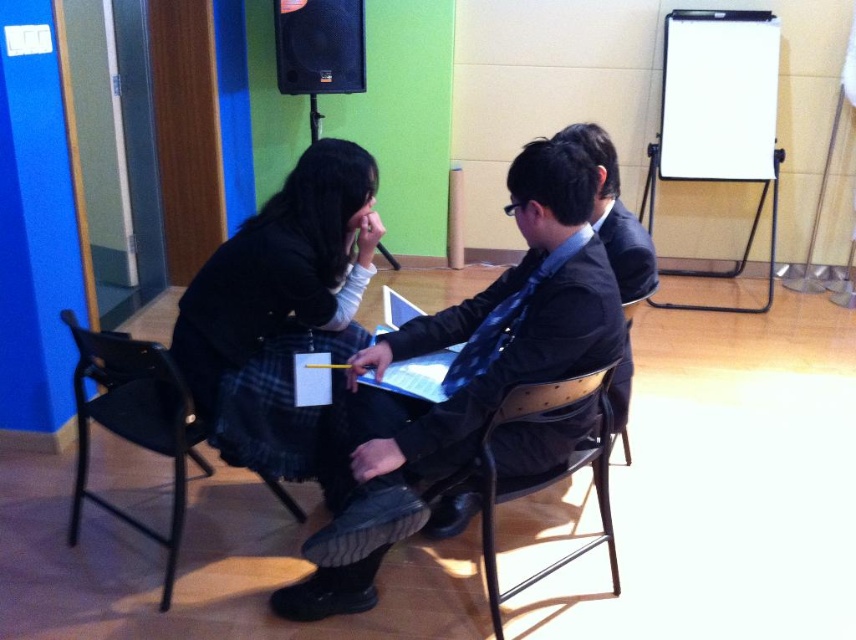
Question: Which object is positioned closest to the blue checkered tie at center?

Choices:
 (A) brown leather chair at center
 (B) metallic black chair at center

Answer: (B)

Question: Among these points, which one is farthest from the camera?

Choices:
 (A) (508, 342)
 (B) (337, 56)
 (C) (94, 380)
 (D) (527, 358)

Answer: (B)

Question: Is black matte business suit at center positioned before metallic black chair at center?

Choices:
 (A) no
 (B) yes

Answer: (B)

Question: Is metallic black chair at center smaller than black plastic speaker at upper center?

Choices:
 (A) yes
 (B) no

Answer: (B)

Question: Which of the following is the closest to the observer?

Choices:
 (A) black plastic chair at lower left
 (B) blue checkered tie at center

Answer: (B)

Question: Is matte black jacket at center positioned before black matte business suit at center?

Choices:
 (A) no
 (B) yes

Answer: (A)